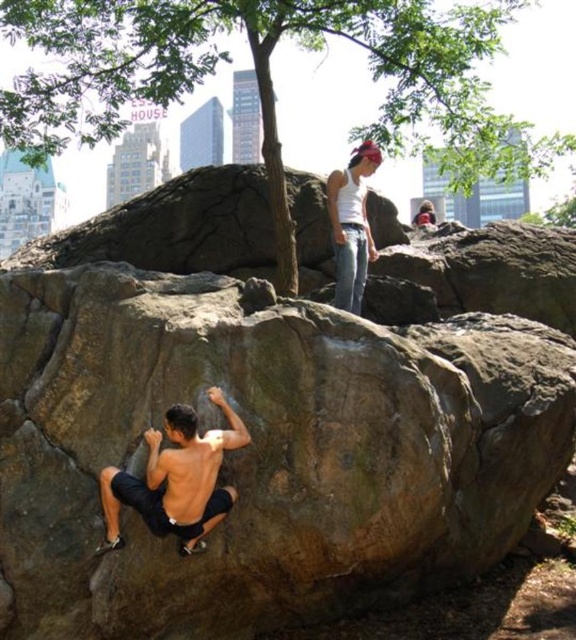
You are a drone operator trying to capture aerial footage of the rock climbing scene. The drone has a camera that can focus on a specific point. You need to position the drone to capture the green leafy tree at upper center. What are the coordinates where you should direct the drone to focus?

The coordinates for the green leafy tree at upper center are point (271,77).

You are standing at the base of the boulder and want to reach the point marked at coordinates point (x=295, y=10). Given that the distance between you and this point is 206.54 feet, can you estimate how far you need to walk to reach it?

The distance between you and the point (x=295, y=10) is 206.54 feet, so you need to walk approximately 206.54 feet to reach it.